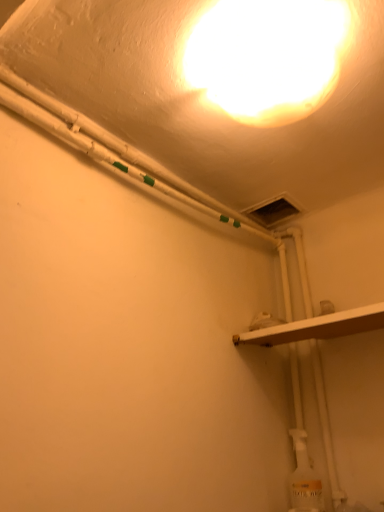
Question: Does white glossy light fixture at upper center have a lesser height compared to white matte shelf at lower right?

Choices:
 (A) yes
 (B) no

Answer: (B)

Question: Is white glossy light fixture at upper center further to camera compared to white matte shelf at lower right?

Choices:
 (A) no
 (B) yes

Answer: (A)

Question: Is the depth of white glossy light fixture at upper center less than that of white matte shelf at lower right?

Choices:
 (A) no
 (B) yes

Answer: (B)

Question: Is white glossy light fixture at upper center turned away from white matte shelf at lower right?

Choices:
 (A) yes
 (B) no

Answer: (B)

Question: Considering the relative sizes of white glossy light fixture at upper center and white matte shelf at lower right in the image provided, is white glossy light fixture at upper center taller than white matte shelf at lower right?

Choices:
 (A) no
 (B) yes

Answer: (B)

Question: From a real-world perspective, is white glossy light fixture at upper center located higher than white matte shelf at lower right?

Choices:
 (A) no
 (B) yes

Answer: (B)

Question: Is white matte shelf at lower right positioned far away from white glossy light fixture at upper center?

Choices:
 (A) no
 (B) yes

Answer: (A)

Question: Is white matte shelf at lower right bigger than white glossy light fixture at upper center?

Choices:
 (A) no
 (B) yes

Answer: (A)

Question: Is white matte shelf at lower right beside white glossy light fixture at upper center?

Choices:
 (A) yes
 (B) no

Answer: (B)

Question: Can you confirm if white matte shelf at lower right is thinner than white glossy light fixture at upper center?

Choices:
 (A) yes
 (B) no

Answer: (B)

Question: Is white matte shelf at lower right facing away from white glossy light fixture at upper center?

Choices:
 (A) yes
 (B) no

Answer: (B)

Question: Can we say white matte shelf at lower right lies outside white glossy light fixture at upper center?

Choices:
 (A) yes
 (B) no

Answer: (A)

Question: Is white glossy light fixture at upper center situated inside white matte shelf at lower right or outside?

Choices:
 (A) inside
 (B) outside

Answer: (B)